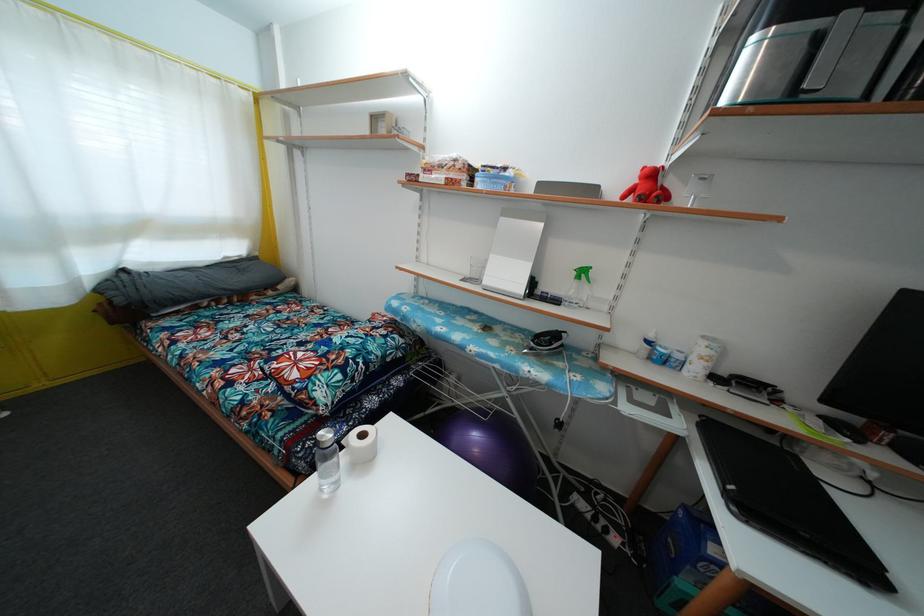
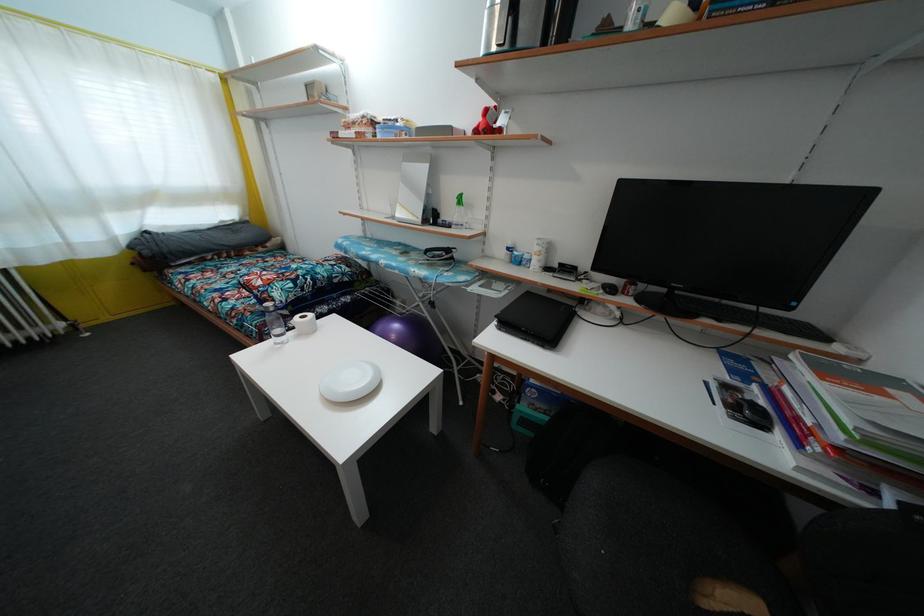
The point at [655,180] is marked in the first image. Where is the corresponding point in the second image?

(490, 119)